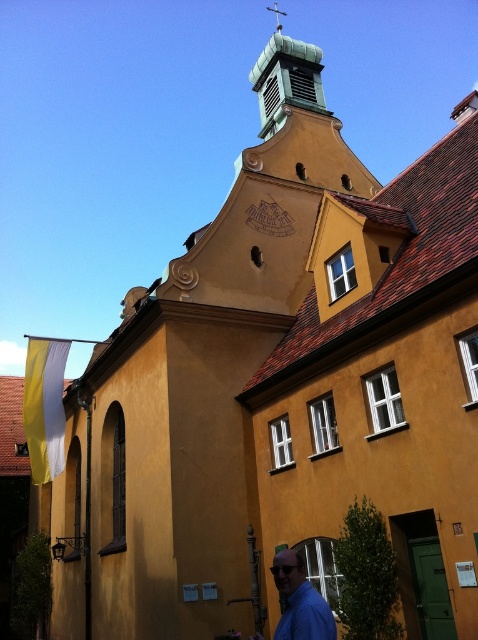
You are a tourist standing in front of the historic building. You notice the green copper spire at upper center and the blue matte shirt at lower right. Which object is positioned to the right side of the other?

The green copper spire at upper center is to the right of the blue matte shirt at lower right.

You are standing in front of the historic building and notice the green copper spire at upper center and the blue matte shirt at lower right. Which object is positioned higher in the image?

The green copper spire at upper center is positioned higher than the blue matte shirt at lower right in the image.

You are standing in front of the historic building and notice two points marked on its facade. The first point is located at coordinates point (267,51) and the second at point (306,602). Which of these points is closer to you?

Point (267,51) is further to the camera than point (306,602). Therefore, the point closer to you is point (306,602).